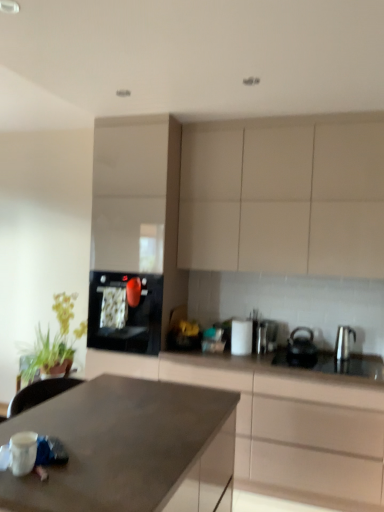
Question: Which direction should I rotate to look at satin metallic toaster at center, which is counted as the 1th appliance, starting from the right?

Choices:
 (A) right
 (B) left

Answer: (A)

Question: Considering the relative sizes of black glossy oven at center, the first kitchen appliance positioned from the left, and black matte kettle at right, which appears as the 2th kitchen appliance when viewed from the left, in the image provided, is black glossy oven at center, the first kitchen appliance positioned from the left, smaller than black matte kettle at right, which appears as the 2th kitchen appliance when viewed from the left,?

Choices:
 (A) yes
 (B) no

Answer: (B)

Question: Is black glossy oven at center, the first kitchen appliance positioned from the left, thinner than black matte kettle at right, which appears as the 2th kitchen appliance when viewed from the left?

Choices:
 (A) yes
 (B) no

Answer: (B)

Question: Is black matte kettle at right, which appears as the 2th kitchen appliance when viewed from the left, at the back of black glossy oven at center, the first kitchen appliance positioned from the left?

Choices:
 (A) no
 (B) yes

Answer: (A)

Question: Would you consider black glossy oven at center, the 3th kitchen appliance from the right, to be distant from black matte kettle at right, the 2th kitchen appliance from the right?

Choices:
 (A) yes
 (B) no

Answer: (A)

Question: Does black glossy oven at center, the first kitchen appliance positioned from the left, have a larger size compared to black matte kettle at right, the 2th kitchen appliance from the right?

Choices:
 (A) no
 (B) yes

Answer: (B)

Question: Considering the relative sizes of black glossy oven at center, the 3th kitchen appliance from the right, and black matte kettle at right, the 2th kitchen appliance from the right, in the image provided, is black glossy oven at center, the 3th kitchen appliance from the right, shorter than black matte kettle at right, the 2th kitchen appliance from the right,?

Choices:
 (A) no
 (B) yes

Answer: (A)

Question: Does matte brown cabinet at center, the third cabinetry from the back, touch black matte kettle at right, which appears as the 2th kitchen appliance when viewed from the left?

Choices:
 (A) yes
 (B) no

Answer: (B)

Question: Is matte brown cabinet at center, the first cabinetry positioned from the front, thinner than black matte kettle at right, which appears as the 2th kitchen appliance when viewed from the left?

Choices:
 (A) yes
 (B) no

Answer: (B)

Question: Is the position of matte brown cabinet at center, the first cabinetry positioned from the front, more distant than that of black matte kettle at right, which appears as the 2th kitchen appliance when viewed from the left?

Choices:
 (A) yes
 (B) no

Answer: (B)

Question: Does matte brown cabinet at center, the third cabinetry from the back, have a lesser height compared to black matte kettle at right, which appears as the 2th kitchen appliance when viewed from the left?

Choices:
 (A) yes
 (B) no

Answer: (B)

Question: Does matte brown cabinet at center, the third cabinetry from the back, have a greater height compared to black matte kettle at right, which appears as the 2th kitchen appliance when viewed from the left?

Choices:
 (A) no
 (B) yes

Answer: (B)

Question: Considering the relative positions of matte brown cabinet at center, the third cabinetry from the back, and black matte kettle at right, the 2th kitchen appliance from the right, in the image provided, is matte brown cabinet at center, the third cabinetry from the back, to the right of black matte kettle at right, the 2th kitchen appliance from the right, from the viewer's perspective?

Choices:
 (A) no
 (B) yes

Answer: (A)

Question: Is the position of white glossy cabinet at center, marked as the third cabinetry in a front-to-back arrangement, more distant than that of matte gray countertop at center?

Choices:
 (A) yes
 (B) no

Answer: (A)